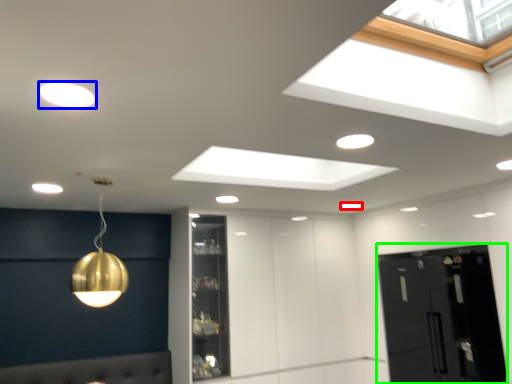
Question: Estimate the real-world distances between objects in this image. Which object is closer to lamp (highlighted by a red box), lamp (highlighted by a blue box) or glass door (highlighted by a green box)?

Choices:
 (A) lamp
 (B) glass door

Answer: (B)